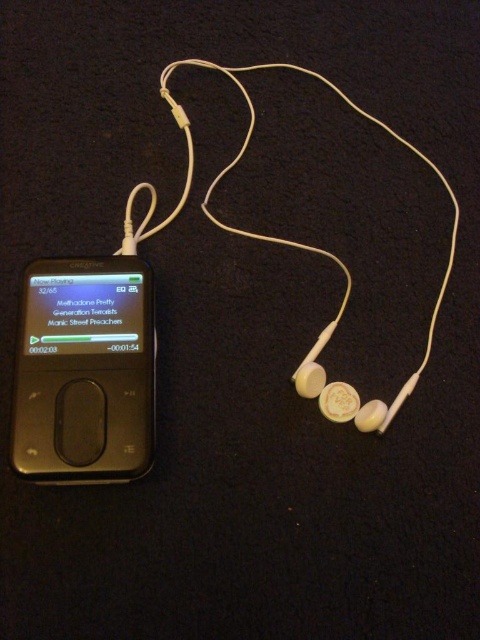
Consider the image. Is gold plastic ipod at center to the left of white matte earphone at center from the viewer's perspective?

Indeed, gold plastic ipod at center is positioned on the left side of white matte earphone at center.

Between gold plastic ipod at center and white matte earphone at center, which one appears on the right side from the viewer's perspective?

white matte earphone at center

Image resolution: width=480 pixels, height=640 pixels. What are the coordinates of `gold plastic ipod at center` in the screenshot? It's located at 84,371.